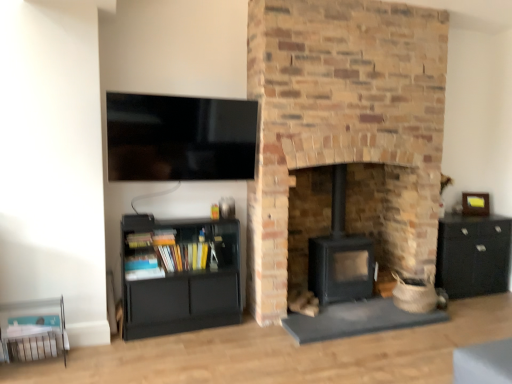
I want to click on free space on the front side of black matte wood burning stove at center, so click(351, 313).